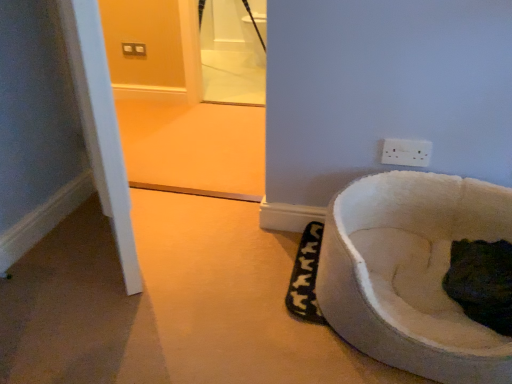
Question: Should I look upward or downward to see white soft pet bed at lower right?

Choices:
 (A) down
 (B) up

Answer: (A)

Question: Is white soft pet bed at lower right facing towards dark fur cat at lower right?

Choices:
 (A) yes
 (B) no

Answer: (A)

Question: Is white soft pet bed at lower right to the right of dark fur cat at lower right from the viewer's perspective?

Choices:
 (A) no
 (B) yes

Answer: (A)

Question: From the image's perspective, is white soft pet bed at lower right on dark fur cat at lower right?

Choices:
 (A) no
 (B) yes

Answer: (B)

Question: Does white soft pet bed at lower right appear on the left side of dark fur cat at lower right?

Choices:
 (A) no
 (B) yes

Answer: (B)

Question: Can you confirm if white soft pet bed at lower right is shorter than dark fur cat at lower right?

Choices:
 (A) yes
 (B) no

Answer: (B)

Question: Considering the relative sizes of white soft pet bed at lower right and dark fur cat at lower right in the image provided, is white soft pet bed at lower right taller than dark fur cat at lower right?

Choices:
 (A) yes
 (B) no

Answer: (A)

Question: Does white plastic power plugs and sockets at upper right turn towards dark fur cat at lower right?

Choices:
 (A) no
 (B) yes

Answer: (A)

Question: Can you confirm if white plastic power plugs and sockets at upper right is bigger than dark fur cat at lower right?

Choices:
 (A) no
 (B) yes

Answer: (A)

Question: Does white plastic power plugs and sockets at upper right appear on the left side of dark fur cat at lower right?

Choices:
 (A) no
 (B) yes

Answer: (B)

Question: From the image's perspective, does white plastic power plugs and sockets at upper right appear higher than dark fur cat at lower right?

Choices:
 (A) yes
 (B) no

Answer: (A)

Question: Is white plastic power plugs and sockets at upper right shorter than dark fur cat at lower right?

Choices:
 (A) yes
 (B) no

Answer: (A)

Question: Is white plastic power plugs and sockets at upper right smaller than dark fur cat at lower right?

Choices:
 (A) yes
 (B) no

Answer: (A)

Question: Is white soft pet bed at lower right not close to white plastic power plugs and sockets at upper right?

Choices:
 (A) no
 (B) yes

Answer: (A)